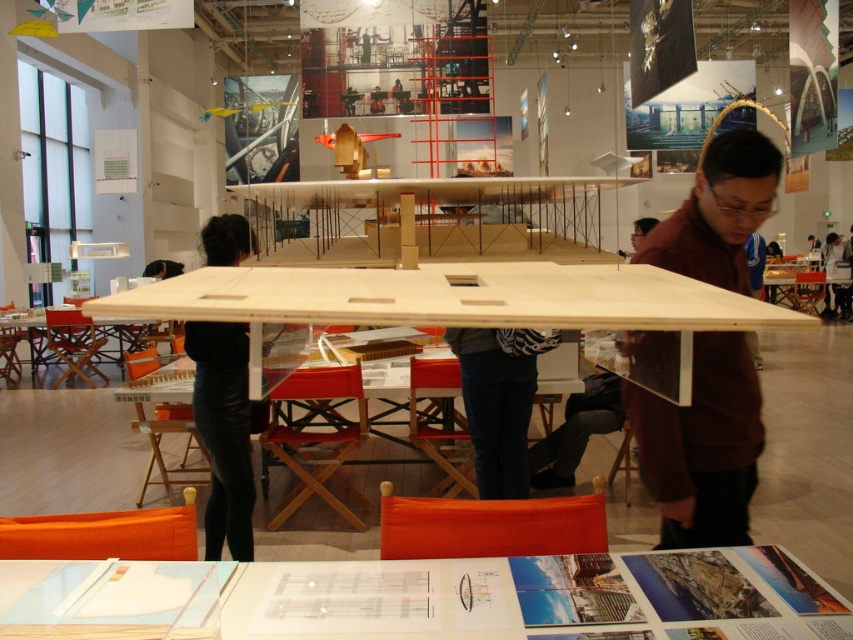
You are standing in the exhibition space and see both the black leather pants at center and the denim pants at center. Which pair of pants is closer to you?

The black leather pants at center is closer to the viewer than the denim pants at center.

You are a museum visitor who wants to take a photo of both the wooden table at center and the black leather pants at center in the same frame. Your camera has a maximum focus range of 1.5 meters. Can you capture both objects in one shot without moving your position?

The wooden table at center is 1.28 meters from the black leather pants at center. Since the distance between them is within the camera maximum focus range of 1.5 meters, you can capture both objects in one shot without moving your position.